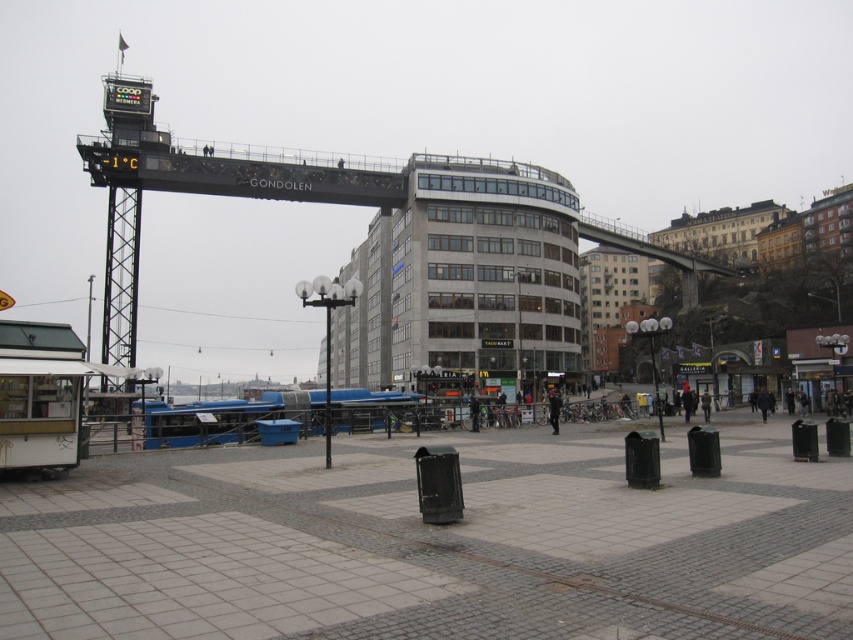
Who is shorter, dark blue jacket at center or dark gray jacket at center?

Standing shorter between the two is dark gray jacket at center.

How much distance is there between dark blue jacket at center and dark gray jacket at center?

dark blue jacket at center and dark gray jacket at center are 10.91 meters apart.

Is point (556, 429) in front of point (701, 392)?

Yes, point (556, 429) is in front of point (701, 392).

Locate an element on the screen. The image size is (853, 640). dark blue jacket at center is located at coordinates (554, 410).

Between metallic pole at center and dark gray jacket at center, which one appears on the left side from the viewer's perspective?

metallic pole at center is more to the left.

Between metallic pole at center and dark gray jacket at center, which one appears on the right side from the viewer's perspective?

dark gray jacket at center is more to the right.

Describe the element at coordinates (328, 378) in the screenshot. The width and height of the screenshot is (853, 640). I see `metallic pole at center` at that location.

Where is `metallic pole at center`? metallic pole at center is located at coordinates (328, 378).

Is metallic pole at center wider than dark blue jacket at center?

Indeed, metallic pole at center has a greater width compared to dark blue jacket at center.

How much distance is there between metallic pole at center and dark blue jacket at center?

The distance of metallic pole at center from dark blue jacket at center is 74.18 meters.

Find the location of `metallic pole at center`. metallic pole at center is located at coordinates (328, 378).